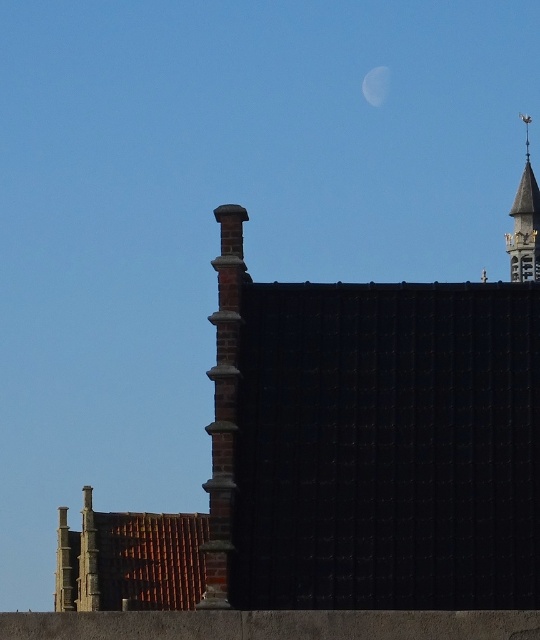
Question: Does polished brass bell tower at upper right have a greater width compared to silver metallic moon at upper center?

Choices:
 (A) yes
 (B) no

Answer: (A)

Question: Is polished brass bell tower at upper right bigger than silver metallic moon at upper center?

Choices:
 (A) no
 (B) yes

Answer: (B)

Question: Does polished brass bell tower at upper right have a greater width compared to silver metallic moon at upper center?

Choices:
 (A) no
 (B) yes

Answer: (B)